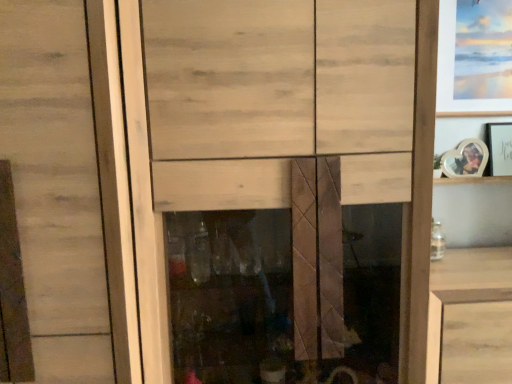
The width and height of the screenshot is (512, 384). Describe the element at coordinates (499, 148) in the screenshot. I see `wooden photo frame at upper right, placed as the 2th picture frame when sorted from top to bottom` at that location.

The height and width of the screenshot is (384, 512). I want to click on wooden heart-shaped photo frame at upper right, the 3th picture frame when ordered from top to bottom, so click(x=465, y=159).

Where is `wooden photo frame at upper right, placed as the 2th picture frame when sorted from top to bottom`? wooden photo frame at upper right, placed as the 2th picture frame when sorted from top to bottom is located at coordinates (499, 148).

Measure the distance from wooden photo frame at upper right, the second picture frame ordered from the bottom, to wooden heart-shaped photo frame at upper right, the 3th picture frame when ordered from top to bottom.

wooden photo frame at upper right, the second picture frame ordered from the bottom, is 3.51 inches away from wooden heart-shaped photo frame at upper right, the 3th picture frame when ordered from top to bottom.

From a real-world perspective, is wooden photo frame at upper right, the second picture frame ordered from the bottom, physically located above or below wooden heart-shaped photo frame at upper right, which is counted as the 1th picture frame, starting from the bottom?

wooden photo frame at upper right, the second picture frame ordered from the bottom, is above wooden heart-shaped photo frame at upper right, which is counted as the 1th picture frame, starting from the bottom.

Which object is positioned more to the right, wooden photo frame at upper right, the second picture frame ordered from the bottom, or wooden heart-shaped photo frame at upper right, which is counted as the 1th picture frame, starting from the bottom?

Positioned to the right is wooden photo frame at upper right, the second picture frame ordered from the bottom.

Is point (507, 125) closer or farther from the camera than point (453, 155)?

Point (507, 125) is closer to the camera than point (453, 155).

Are wooden heart-shaped photo frame at upper right, which is counted as the 1th picture frame, starting from the bottom, and wooden photo frame at upper right, placed as the 2th picture frame when sorted from top to bottom, far apart?

No, there isn't a large distance between wooden heart-shaped photo frame at upper right, which is counted as the 1th picture frame, starting from the bottom, and wooden photo frame at upper right, placed as the 2th picture frame when sorted from top to bottom.

Considering the relative sizes of wooden heart-shaped photo frame at upper right, the 3th picture frame when ordered from top to bottom, and wooden photo frame at upper right, placed as the 2th picture frame when sorted from top to bottom, in the image provided, is wooden heart-shaped photo frame at upper right, the 3th picture frame when ordered from top to bottom, shorter than wooden photo frame at upper right, placed as the 2th picture frame when sorted from top to bottom,?

Indeed, wooden heart-shaped photo frame at upper right, the 3th picture frame when ordered from top to bottom, has a lesser height compared to wooden photo frame at upper right, placed as the 2th picture frame when sorted from top to bottom.

From the wooden photo frame at upper right, placed as the 2th picture frame when sorted from top to bottom, count the 2nd picture frame to the left and point to it. Please provide its 2D coordinates.

[(465, 159)]

From a real-world perspective, is wooden heart-shaped photo frame at upper right, which is counted as the 1th picture frame, starting from the bottom, under wooden photo frame at upper right, the second picture frame ordered from the bottom?

Yes, from a real-world perspective, wooden heart-shaped photo frame at upper right, which is counted as the 1th picture frame, starting from the bottom, is beneath wooden photo frame at upper right, the second picture frame ordered from the bottom.

Between wooden frame at right and matte white picture frame at upper right, the 3th picture frame ordered from the bottom, which one is positioned behind?

Positioned behind is wooden frame at right.

From a real-world perspective, is wooden frame at right physically located above or below matte white picture frame at upper right, which appears as the first picture frame when viewed from the top?

wooden frame at right is situated lower than matte white picture frame at upper right, which appears as the first picture frame when viewed from the top, in the real world.

Which of these two, wooden frame at right or matte white picture frame at upper right, which appears as the first picture frame when viewed from the top, is smaller?

Smaller between the two is wooden frame at right.

Can we say wooden frame at right lies outside matte white picture frame at upper right, the 3th picture frame ordered from the bottom?

Yes, wooden frame at right is not within matte white picture frame at upper right, the 3th picture frame ordered from the bottom.

From a real-world perspective, is matte white picture frame at upper right, which appears as the first picture frame when viewed from the top, physically located above or below wooden heart-shaped photo frame at upper right, which is counted as the 1th picture frame, starting from the bottom?

From a real-world perspective, matte white picture frame at upper right, which appears as the first picture frame when viewed from the top, is physically above wooden heart-shaped photo frame at upper right, which is counted as the 1th picture frame, starting from the bottom.

Is matte white picture frame at upper right, the 3th picture frame ordered from the bottom, bigger than wooden heart-shaped photo frame at upper right, the 3th picture frame when ordered from top to bottom?

Yes.

In the scene shown: Can you confirm if matte white picture frame at upper right, which appears as the first picture frame when viewed from the top, is wider than wooden heart-shaped photo frame at upper right, the 3th picture frame when ordered from top to bottom?

Yes, matte white picture frame at upper right, which appears as the first picture frame when viewed from the top, is wider than wooden heart-shaped photo frame at upper right, the 3th picture frame when ordered from top to bottom.

From the image's perspective, is matte white picture frame at upper right, the 3th picture frame ordered from the bottom, over wooden heart-shaped photo frame at upper right, the 3th picture frame when ordered from top to bottom?

Yes.

Does wooden cabinet at lower right have a larger size compared to wooden heart-shaped photo frame at upper right, the 3th picture frame when ordered from top to bottom?

Indeed, wooden cabinet at lower right has a larger size compared to wooden heart-shaped photo frame at upper right, the 3th picture frame when ordered from top to bottom.

From the image's perspective, is wooden cabinet at lower right located beneath wooden heart-shaped photo frame at upper right, the 3th picture frame when ordered from top to bottom?

Indeed, from the image's perspective, wooden cabinet at lower right is shown beneath wooden heart-shaped photo frame at upper right, the 3th picture frame when ordered from top to bottom.

Who is taller, wooden cabinet at lower right or wooden heart-shaped photo frame at upper right, which is counted as the 1th picture frame, starting from the bottom?

wooden cabinet at lower right is taller.

Can you confirm if wooden cabinet at lower right is thinner than wooden heart-shaped photo frame at upper right, which is counted as the 1th picture frame, starting from the bottom?

Incorrect, the width of wooden cabinet at lower right is not less than that of wooden heart-shaped photo frame at upper right, which is counted as the 1th picture frame, starting from the bottom.

Is wooden photo frame at upper right, placed as the 2th picture frame when sorted from top to bottom, looking in the opposite direction of wooden cabinet at lower right?

No, wooden photo frame at upper right, placed as the 2th picture frame when sorted from top to bottom, is not facing away from wooden cabinet at lower right.

From the image's perspective, who appears lower, wooden photo frame at upper right, the second picture frame ordered from the bottom, or wooden cabinet at lower right?

From the image's view, wooden cabinet at lower right is below.

Locate an element on the screen. The image size is (512, 384). vanity below the wooden photo frame at upper right, the second picture frame ordered from the bottom (from a real-world perspective) is located at coordinates (462, 287).

From a real-world perspective, who is located lower, wooden photo frame at upper right, the second picture frame ordered from the bottom, or wooden cabinet at lower right?

wooden cabinet at lower right.

Is matte white picture frame at upper right, the 3th picture frame ordered from the bottom, inside the boundaries of wooden frame at right, or outside?

matte white picture frame at upper right, the 3th picture frame ordered from the bottom, is spatially situated outside wooden frame at right.

Based on the photo, from the image's perspective, is matte white picture frame at upper right, which appears as the first picture frame when viewed from the top, over wooden frame at right?

Correct, matte white picture frame at upper right, which appears as the first picture frame when viewed from the top, appears higher than wooden frame at right in the image.

Considering the sizes of matte white picture frame at upper right, the 3th picture frame ordered from the bottom, and wooden frame at right in the image, is matte white picture frame at upper right, the 3th picture frame ordered from the bottom, bigger or smaller than wooden frame at right?

matte white picture frame at upper right, the 3th picture frame ordered from the bottom, is bigger than wooden frame at right.

Does matte white picture frame at upper right, which appears as the first picture frame when viewed from the top, touch wooden frame at right?

No, matte white picture frame at upper right, which appears as the first picture frame when viewed from the top, is not next to wooden frame at right.

There is a wooden heart-shaped photo frame at upper right, the 3th picture frame when ordered from top to bottom. Where is `the 1st picture frame above it (from the image's perspective)`? This screenshot has height=384, width=512. the 1st picture frame above it (from the image's perspective) is located at coordinates (499, 148).

From a real-world perspective, count 1st picture frames upward from the wooden heart-shaped photo frame at upper right, which is counted as the 1th picture frame, starting from the bottom, and point to it. Please provide its 2D coordinates.

[(499, 148)]

Looking at the image, which one is located closer to wooden cabinet at lower right, wooden frame at right or matte white picture frame at upper right, the 3th picture frame ordered from the bottom?

Based on the image, wooden frame at right appears to be nearer to wooden cabinet at lower right.

From the image, which object appears to be farther from matte white picture frame at upper right, the 3th picture frame ordered from the bottom, wooden frame at right or wooden photo frame at upper right, the second picture frame ordered from the bottom?

wooden frame at right lies further to matte white picture frame at upper right, the 3th picture frame ordered from the bottom, than the other object.

Looking at the image, which one is located closer to wooden photo frame at upper right, the second picture frame ordered from the bottom, matte white picture frame at upper right, which appears as the first picture frame when viewed from the top, or wooden cabinet at lower right?

matte white picture frame at upper right, which appears as the first picture frame when viewed from the top, is positioned closer to the anchor wooden photo frame at upper right, the second picture frame ordered from the bottom.

Looking at the image, which one is located further to wooden photo frame at upper right, the second picture frame ordered from the bottom, matte white picture frame at upper right, which appears as the first picture frame when viewed from the top, or wooden heart-shaped photo frame at upper right, the 3th picture frame when ordered from top to bottom?

matte white picture frame at upper right, which appears as the first picture frame when viewed from the top, lies further to wooden photo frame at upper right, the second picture frame ordered from the bottom, than the other object.

Estimate the real-world distances between objects in this image. Which object is closer to matte white picture frame at upper right, the 3th picture frame ordered from the bottom, wooden photo frame at upper right, placed as the 2th picture frame when sorted from top to bottom, or wooden frame at right?

Based on the image, wooden photo frame at upper right, placed as the 2th picture frame when sorted from top to bottom, appears to be nearer to matte white picture frame at upper right, the 3th picture frame ordered from the bottom.

Considering their positions, is wooden heart-shaped photo frame at upper right, the 3th picture frame when ordered from top to bottom, positioned further to wooden photo frame at upper right, the second picture frame ordered from the bottom, than wooden frame at right?

The object further to wooden photo frame at upper right, the second picture frame ordered from the bottom, is wooden frame at right.

Looking at this image, based on their spatial positions, is matte white picture frame at upper right, which appears as the first picture frame when viewed from the top, or wooden heart-shaped photo frame at upper right, the 3th picture frame when ordered from top to bottom, further from wooden frame at right?

matte white picture frame at upper right, which appears as the first picture frame when viewed from the top.

Which object lies nearer to the anchor point wooden frame at right, wooden cabinet at lower right or wooden photo frame at upper right, placed as the 2th picture frame when sorted from top to bottom?

wooden photo frame at upper right, placed as the 2th picture frame when sorted from top to bottom, is positioned closer to the anchor wooden frame at right.

Find the location of `picture frame that lies between wooden photo frame at upper right, placed as the 2th picture frame when sorted from top to bottom, and wooden cabinet at lower right from top to bottom`. picture frame that lies between wooden photo frame at upper right, placed as the 2th picture frame when sorted from top to bottom, and wooden cabinet at lower right from top to bottom is located at coordinates (465, 159).

You are a GUI agent. You are given a task and a screenshot of the screen. Output one action in this format:
    pyautogui.click(x=<x>, y=<y>)
    Task: Click on the shelf between wooden photo frame at upper right, placed as the 2th picture frame when sorted from top to bottom, and wooden cabinet at lower right from top to bottom
    The height and width of the screenshot is (384, 512).
    Given the screenshot: What is the action you would take?
    pyautogui.click(x=470, y=180)

Identify the location of shelf situated between wooden heart-shaped photo frame at upper right, the 3th picture frame when ordered from top to bottom, and wooden photo frame at upper right, the second picture frame ordered from the bottom, from left to right. This screenshot has width=512, height=384. (470, 180).

What are the coordinates of `picture frame between matte white picture frame at upper right, the 3th picture frame ordered from the bottom, and wooden heart-shaped photo frame at upper right, the 3th picture frame when ordered from top to bottom, from top to bottom` in the screenshot? It's located at (499, 148).